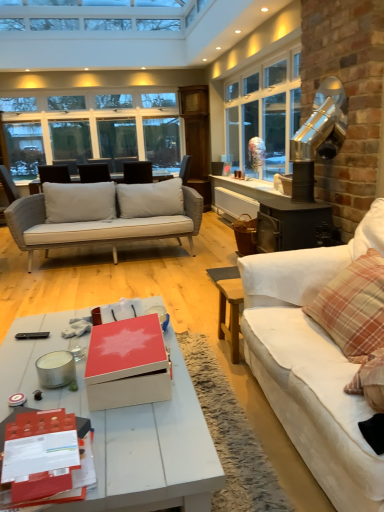
Question: Considering the relative sizes of matte black chair at center and matte red box at center in the image provided, is matte black chair at center wider than matte red box at center?

Choices:
 (A) yes
 (B) no

Answer: (A)

Question: Can you confirm if matte black chair at center is thinner than matte red box at center?

Choices:
 (A) no
 (B) yes

Answer: (A)

Question: Can you see matte black chair at center touching matte red box at center?

Choices:
 (A) yes
 (B) no

Answer: (B)

Question: Is matte black chair at center shorter than matte red box at center?

Choices:
 (A) yes
 (B) no

Answer: (B)

Question: Considering the relative sizes of matte black chair at center and matte red box at center in the image provided, is matte black chair at center taller than matte red box at center?

Choices:
 (A) yes
 (B) no

Answer: (A)

Question: Is matte black chair at center at the right side of matte red box at center?

Choices:
 (A) yes
 (B) no

Answer: (B)

Question: Can you confirm if clear glass window at upper left is positioned to the right of black plastic remote control at lower left?

Choices:
 (A) yes
 (B) no

Answer: (B)

Question: Is clear glass window at upper left closer to the viewer compared to black plastic remote control at lower left?

Choices:
 (A) no
 (B) yes

Answer: (A)

Question: From a real-world perspective, does clear glass window at upper left stand above black plastic remote control at lower left?

Choices:
 (A) no
 (B) yes

Answer: (B)

Question: Does clear glass window at upper left have a lesser height compared to black plastic remote control at lower left?

Choices:
 (A) yes
 (B) no

Answer: (B)

Question: Is clear glass window at upper left thinner than black plastic remote control at lower left?

Choices:
 (A) yes
 (B) no

Answer: (A)

Question: Does clear glass window at upper left have a smaller size compared to black plastic remote control at lower left?

Choices:
 (A) yes
 (B) no

Answer: (B)

Question: Would you consider matte black chair at center to be distant from clear glass window at upper left?

Choices:
 (A) no
 (B) yes

Answer: (A)